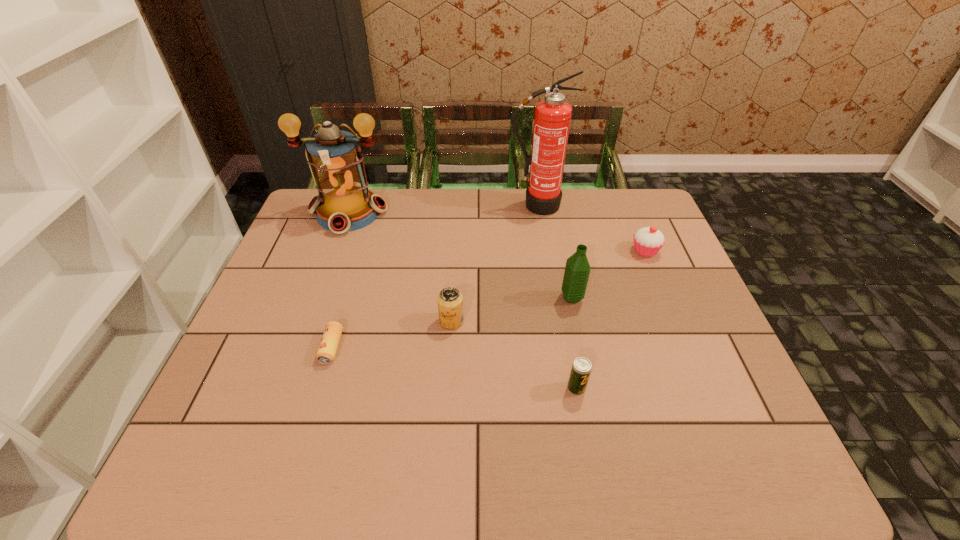
Identify which beer can is the nearest to the second nearest beer can. Please provide its 2D coordinates. Your answer should be formatted as a tuple, i.e. [(x, y)], where the tuple contains the x and y coordinates of a point satisfying the conditions above.

[(450, 300)]

The width and height of the screenshot is (960, 540). I want to click on free space that satisfies the following two spatial constraints: 1. on the front-facing side of the cupcake; 2. on the right side of the sixth shortest object, so [x=335, y=251].

Locate an element on the screen. Image resolution: width=960 pixels, height=540 pixels. free space that satisfies the following two spatial constraints: 1. on the front side of the nearest object; 2. on the left side of the leftmost beer can is located at coordinates (320, 388).

Identify the location of vacant space that satisfies the following two spatial constraints: 1. on the front-facing side of the fourth nearest object; 2. on the right side of the fire extinguisher. This screenshot has width=960, height=540. (551, 298).